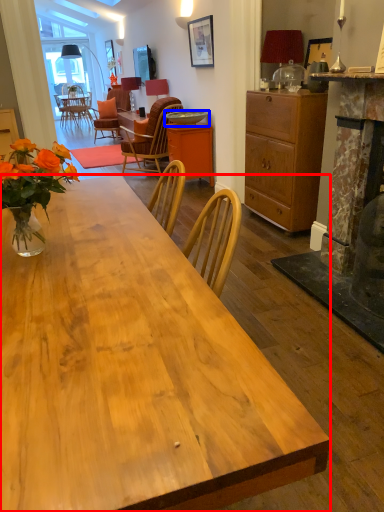
Question: Which object is closer to the camera taking this photo, desk (highlighted by a red box) or round table (highlighted by a blue box)?

Choices:
 (A) desk
 (B) round table

Answer: (A)